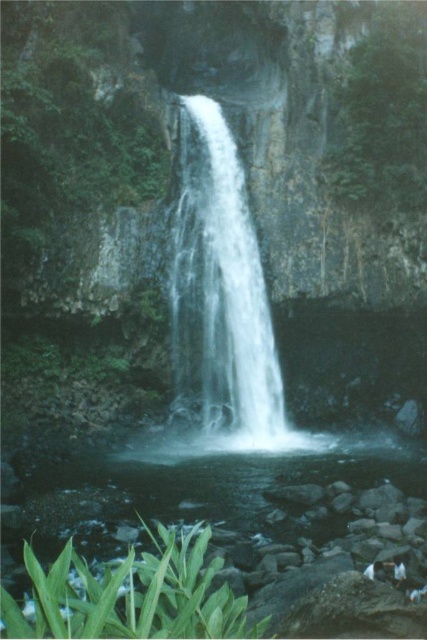
From the picture: You are a photographer planning to capture the white smooth waterfall at center and the green leafy plant at lower left in a single shot. Based on their sizes in the image, which object should you focus on to ensure both are clearly visible in the frame?

The white smooth waterfall at center occupies less space than the green leafy plant at lower left, so focusing on the larger green leafy plant at lower left would help ensure both are clearly visible in the frame.

You are standing at the point marked by the coordinates point (222,278) in the image. Based on the scene description, what would you most likely see directly in front of you?

The point (222,278) marks the white smooth waterfall at center, so you would see the waterfall directly in front of you.